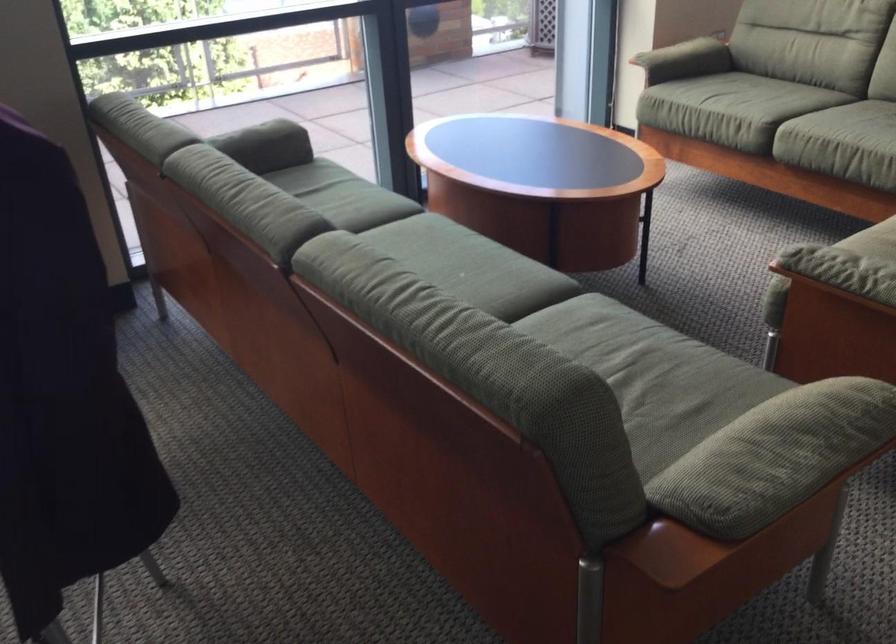
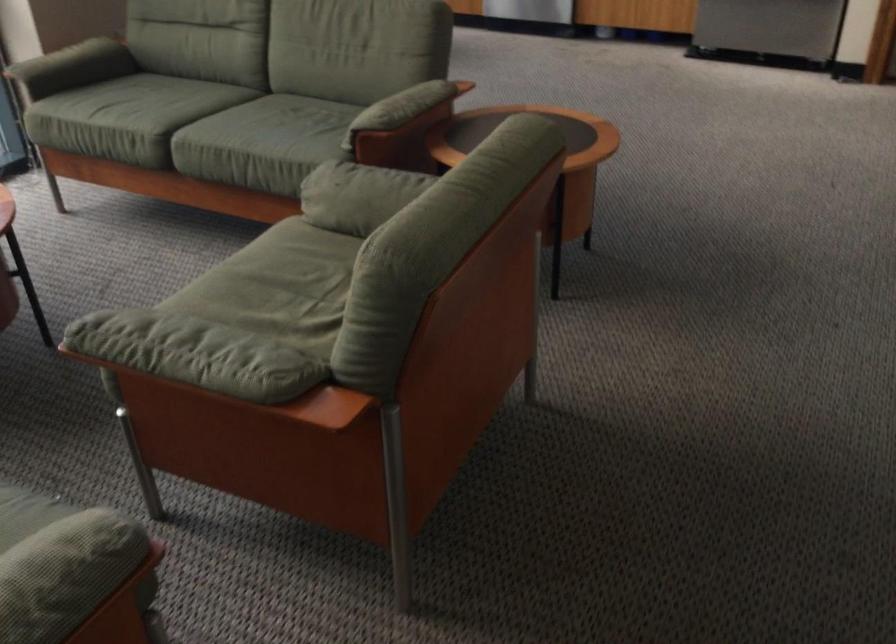
The point at (x=704, y=90) is marked in the first image. Where is the corresponding point in the second image?

(97, 108)